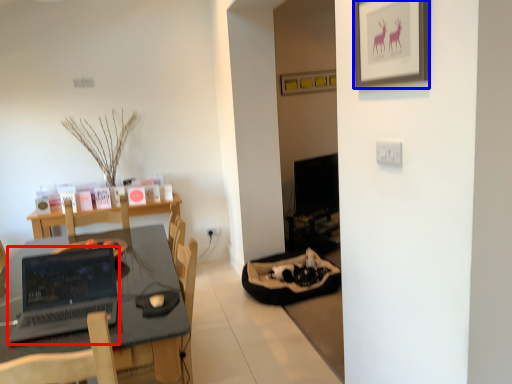
Question: Which of the following is the closest to the observer, laptop (highlighted by a red box) or picture frame (highlighted by a blue box)?

Choices:
 (A) laptop
 (B) picture frame

Answer: (B)